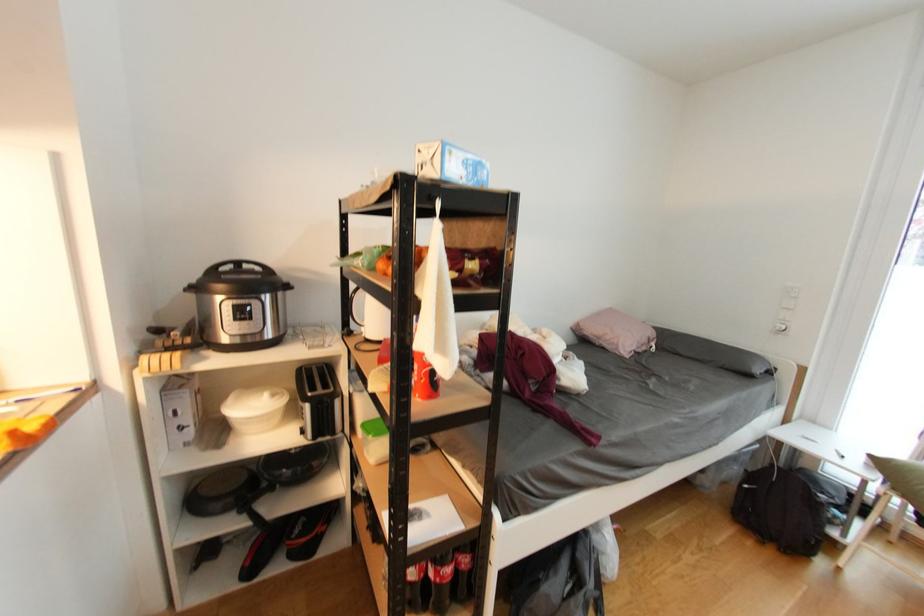
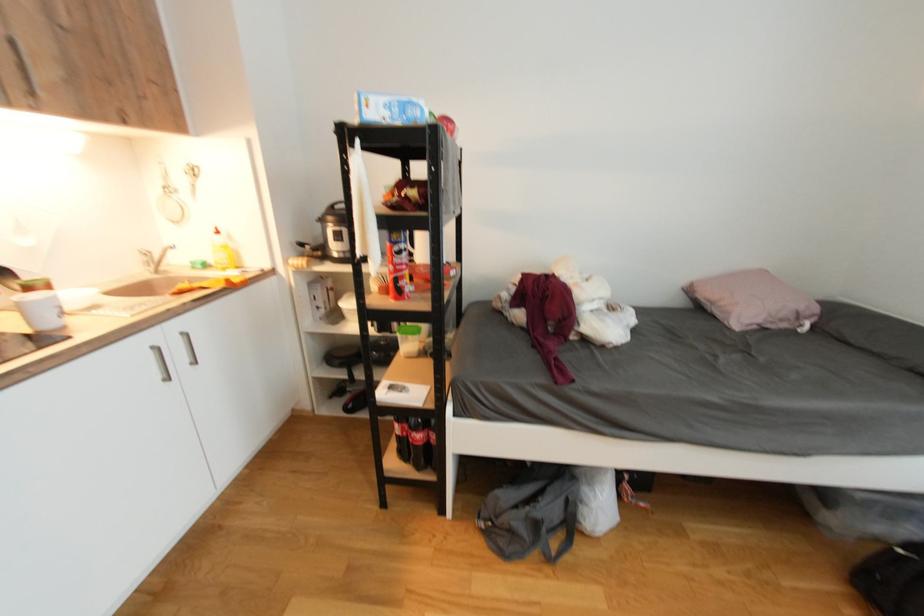
Question: How did the camera likely rotate?

Choices:
 (A) Left
 (B) Right
 (C) Up
 (D) Down

Answer: (A)